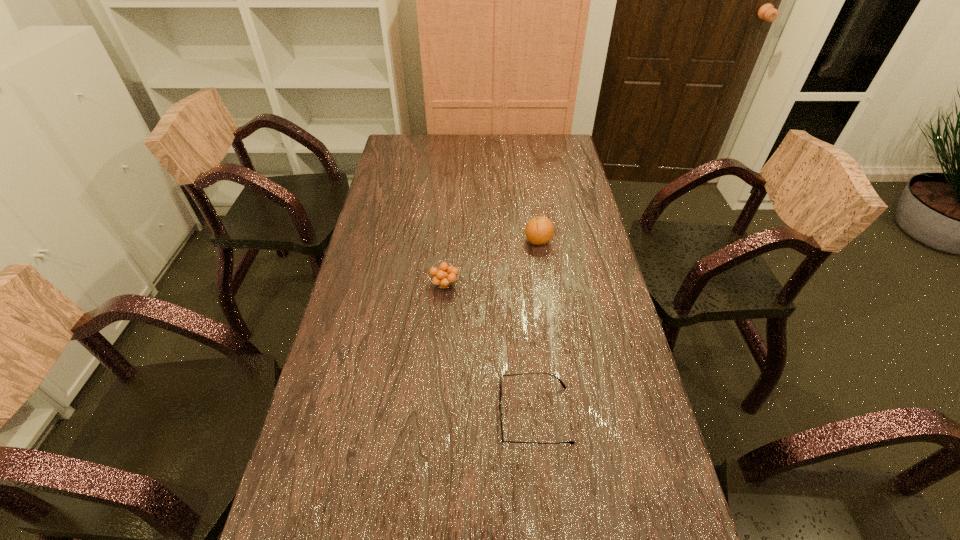
Where is `free spot located on the front-facing side of the nearest object`? free spot located on the front-facing side of the nearest object is located at coordinates (336, 414).

Locate an element on the screen. The height and width of the screenshot is (540, 960). object that is at the right edge is located at coordinates (539, 230).

Identify the location of vacant region at the left edge of the desktop. This screenshot has height=540, width=960. [x=353, y=483].

Image resolution: width=960 pixels, height=540 pixels. Find the location of `vacant space at the right edge`. vacant space at the right edge is located at coordinates click(x=585, y=210).

The width and height of the screenshot is (960, 540). In the image, there is a desktop. Find the location of `vacant space at the far left corner`. vacant space at the far left corner is located at coordinates (395, 139).

The height and width of the screenshot is (540, 960). In the image, there is a desktop. In order to click on free region at the far right corner in this screenshot , I will do `click(554, 148)`.

Find the location of a particular element. vacant region between the left orange fruit and the farthest object is located at coordinates (492, 263).

What are the coordinates of `empty space between the second tallest object and the shortest object` in the screenshot? It's located at (490, 349).

What are the coordinates of `free space between the spectacles and the leftmost object` in the screenshot? It's located at (490, 349).

Where is `unoccupied position between the left orange fruit and the farther orange fruit`? This screenshot has width=960, height=540. unoccupied position between the left orange fruit and the farther orange fruit is located at coordinates (492, 263).